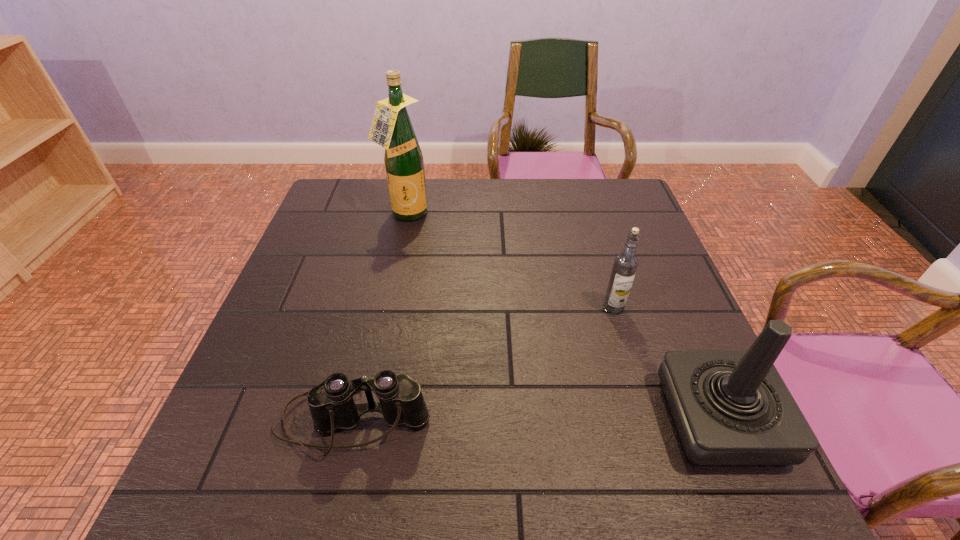
At what (x,y) coordinates should I click in order to perform the action: click on free space on the desktop that is between the binoculars and the joystick and is positioned on the front-facing side of the farthest object. Please return your answer as a coordinate pair (x, y). This screenshot has height=540, width=960. Looking at the image, I should click on (537, 421).

Locate an element on the screen. The image size is (960, 540). vacant space on the desktop that is between the binoculars and the joystick and is positioned on the label of the third tallest object is located at coordinates (516, 421).